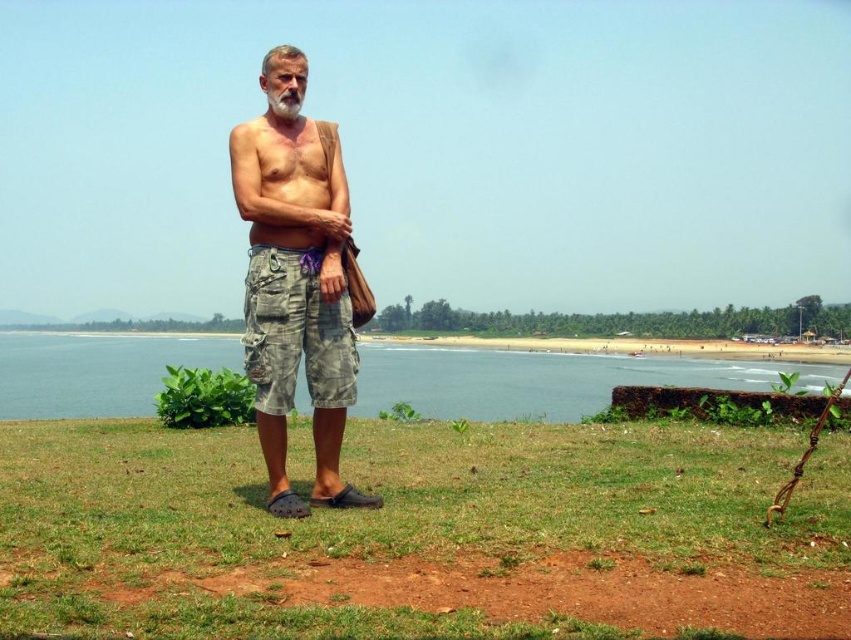
Does green grass at center appear over camouflage cargo shorts at center?

Incorrect, green grass at center is not positioned above camouflage cargo shorts at center.

Which is in front, point (603, 620) or point (306, 262)?

Positioned in front is point (603, 620).

Does point (670, 616) lie behind point (248, 296)?

No, (670, 616) is in front of (248, 296).

The height and width of the screenshot is (640, 851). Find the location of `green grass at center`. green grass at center is located at coordinates (423, 534).

Consider the image. Can you confirm if green grass at center is taller than camouflage shorts at center?

No.

Between green grass at center and camouflage shorts at center, which one is positioned lower?

Positioned lower is green grass at center.

You are a GUI agent. You are given a task and a screenshot of the screen. Output one action in this format:
    pyautogui.click(x=<x>, y=<y>)
    Task: Click on the green grass at center
    
    Given the screenshot: What is the action you would take?
    pyautogui.click(x=423, y=534)

Which is above, camouflage shorts at center or blue water at lower left?

camouflage shorts at center

Is camouflage shorts at center taller than blue water at lower left?

Indeed, camouflage shorts at center has a greater height compared to blue water at lower left.

The image size is (851, 640). I want to click on camouflage shorts at center, so click(x=295, y=280).

Where is `camouflage shorts at center`? camouflage shorts at center is located at coordinates (295, 280).